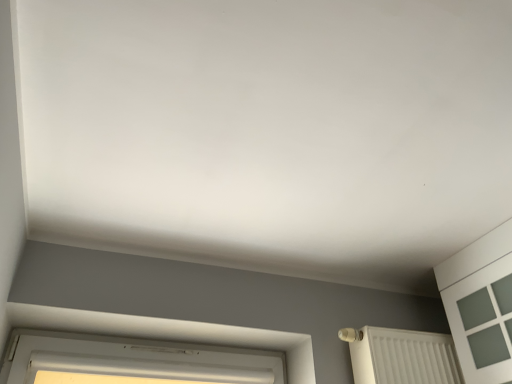
Question: From the image's perspective, is white textured radiator at lower right positioned above or below white plastic window at lower left?

Choices:
 (A) above
 (B) below

Answer: (A)

Question: Which is correct: white textured radiator at lower right is inside white plastic window at lower left, or outside of it?

Choices:
 (A) outside
 (B) inside

Answer: (A)

Question: From their relative heights in the image, would you say white textured radiator at lower right is taller or shorter than white plastic window at lower left?

Choices:
 (A) tall
 (B) short

Answer: (A)

Question: From the image's perspective, relative to white textured radiator at lower right, is white plastic window at lower left above or below?

Choices:
 (A) above
 (B) below

Answer: (B)

Question: Considering the positions of white plastic window at lower left and white textured radiator at lower right in the image, is white plastic window at lower left wider or thinner than white textured radiator at lower right?

Choices:
 (A) wide
 (B) thin

Answer: (B)

Question: Considering the relative positions of white plastic window at lower left and white textured radiator at lower right in the image provided, is white plastic window at lower left to the left or to the right of white textured radiator at lower right?

Choices:
 (A) right
 (B) left

Answer: (B)

Question: Considering the positions of point (17, 362) and point (420, 360), is point (17, 362) closer or farther from the camera than point (420, 360)?

Choices:
 (A) farther
 (B) closer

Answer: (B)